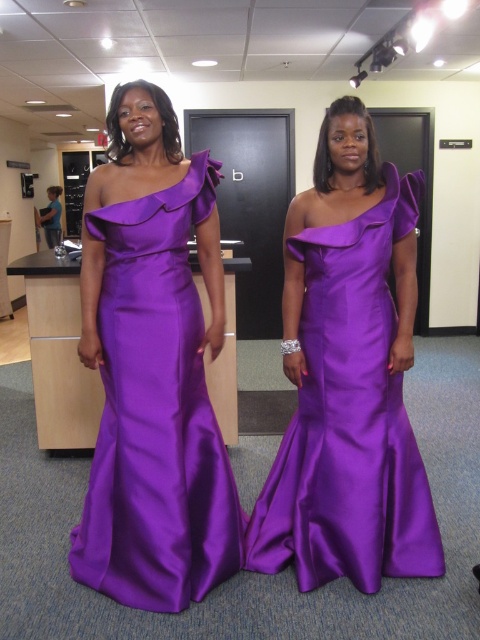
Question: Is the position of purple satin dress at left more distant than that of satin purple dress at center?

Choices:
 (A) no
 (B) yes

Answer: (A)

Question: Where is purple satin dress at left located in relation to satin purple dress at center in the image?

Choices:
 (A) left
 (B) right

Answer: (A)

Question: From the image, what is the correct spatial relationship of purple satin dress at left in relation to satin purple dress at center?

Choices:
 (A) below
 (B) above

Answer: (B)

Question: Which object is farther from the camera taking this photo?

Choices:
 (A) satin purple dress at center
 (B) purple satin dress at left

Answer: (A)